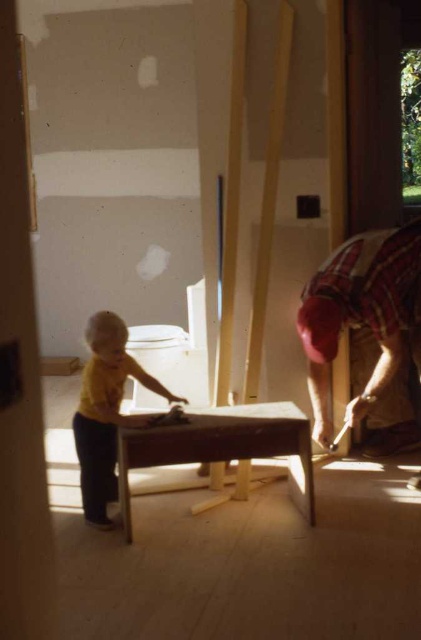
Which of these two, plaid fabric shirt at right or yellow matte shirt at center, stands shorter?

yellow matte shirt at center

Describe the element at coordinates (364, 314) in the screenshot. I see `plaid fabric shirt at right` at that location.

At what (x,y) coordinates should I click in order to perform the action: click on plaid fabric shirt at right. Please return your answer as a coordinate pair (x, y). The height and width of the screenshot is (640, 421). Looking at the image, I should click on (364, 314).

Can you confirm if smooth wooden table at center is bigger than yellow matte shirt at center?

No, smooth wooden table at center is not bigger than yellow matte shirt at center.

Measure the distance from smooth wooden table at center to yellow matte shirt at center.

The distance of smooth wooden table at center from yellow matte shirt at center is 13.17 inches.

In the scene shown: Who is more distant from viewer, (168, 490) or (112, 461)?

The point (168, 490) is behind.

The image size is (421, 640). Identify the location of smooth wooden table at center. (221, 445).

This screenshot has height=640, width=421. Describe the element at coordinates (364, 314) in the screenshot. I see `plaid fabric shirt at right` at that location.

Is point (319, 396) more distant than point (221, 426)?

Yes, point (319, 396) is farther from viewer.

What do you see at coordinates (364, 314) in the screenshot?
I see `plaid fabric shirt at right` at bounding box center [364, 314].

The image size is (421, 640). I want to click on plaid fabric shirt at right, so click(364, 314).